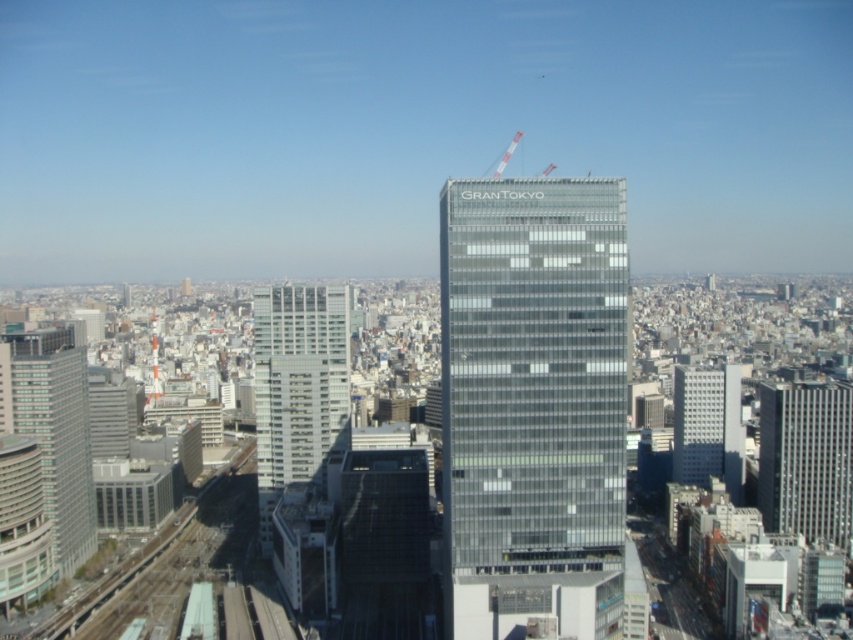
Between silver glass skyscraper at left and silver metallic building at right, which one appears on the left side from the viewer's perspective?

From the viewer's perspective, silver glass skyscraper at left appears more on the left side.

Is point (73, 492) behind point (793, 438)?

Yes, it is behind point (793, 438).

This screenshot has height=640, width=853. I want to click on silver glass skyscraper at left, so click(x=53, y=428).

Which of these two, silver glass skyscraper at left or gray concrete building at right, stands shorter?

gray concrete building at right is shorter.

At what (x,y) coordinates should I click in order to perform the action: click on silver glass skyscraper at left. Please return your answer as a coordinate pair (x, y). The image size is (853, 640). Looking at the image, I should click on (53, 428).

Does silver glass skyscraper at left have a lesser height compared to metallic red crane at upper center?

Incorrect, silver glass skyscraper at left's height does not fall short of metallic red crane at upper center's.

This screenshot has width=853, height=640. What do you see at coordinates (53, 428) in the screenshot? I see `silver glass skyscraper at left` at bounding box center [53, 428].

This screenshot has height=640, width=853. In order to click on silver glass skyscraper at left in this screenshot , I will do `click(53, 428)`.